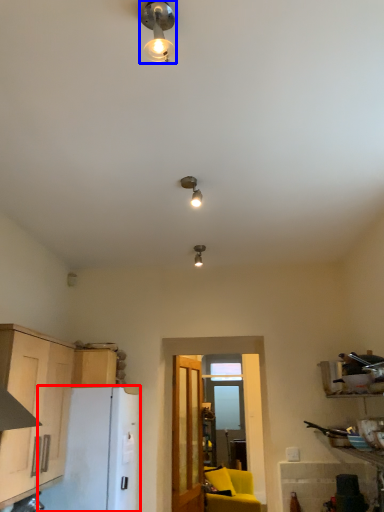
Question: Among these objects, which one is farthest to the camera, appliance (highlighted by a red box) or lamp (highlighted by a blue box)?

Choices:
 (A) appliance
 (B) lamp

Answer: (A)